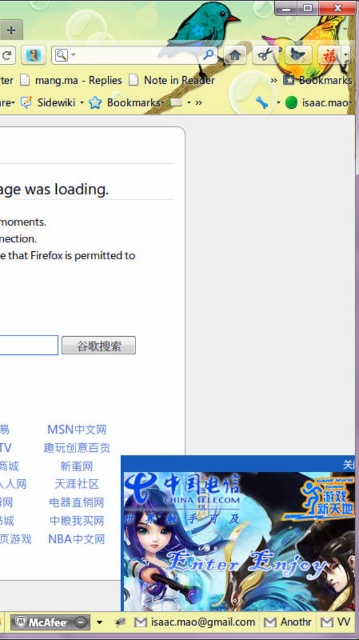
Does matte plastic bird at upper right have a greater width compared to metallic blue bird at upper center?

Yes, matte plastic bird at upper right is wider than metallic blue bird at upper center.

Who is positioned more to the left, matte plastic bird at upper right or metallic blue bird at upper center?

metallic blue bird at upper center

The height and width of the screenshot is (640, 359). What are the coordinates of `matte plastic bird at upper right` in the screenshot? It's located at (309, 51).

Is matte plastic bird at upper right to the right of white glossy email address at bottom from the viewer's perspective?

Yes, matte plastic bird at upper right is to the right of white glossy email address at bottom.

Who is more distant from viewer, (x=313, y=48) or (x=189, y=620)?

The point (x=189, y=620) is behind.

Image resolution: width=359 pixels, height=640 pixels. Find the location of `matte plastic bird at upper right`. matte plastic bird at upper right is located at coordinates (309, 51).

Which is more to the right, metallic blue bird at upper center or white glossy email address at bottom?

From the viewer's perspective, metallic blue bird at upper center appears more on the right side.

Can you confirm if metallic blue bird at upper center is positioned to the right of white glossy email address at bottom?

Indeed, metallic blue bird at upper center is positioned on the right side of white glossy email address at bottom.

Locate an element on the screen. metallic blue bird at upper center is located at coordinates (201, 32).